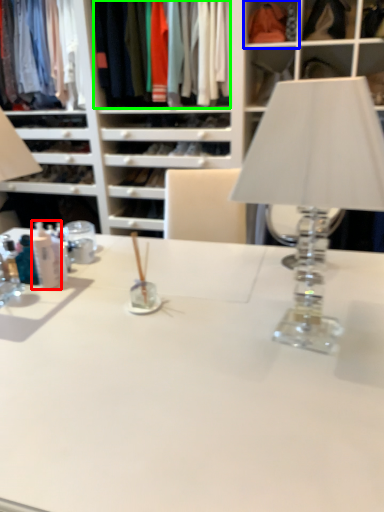
Question: Which object is positioned farthest from toiletry (highlighted by a red box)? Select from cabinet (highlighted by a blue box) and clothing (highlighted by a green box).

Choices:
 (A) cabinet
 (B) clothing

Answer: (A)